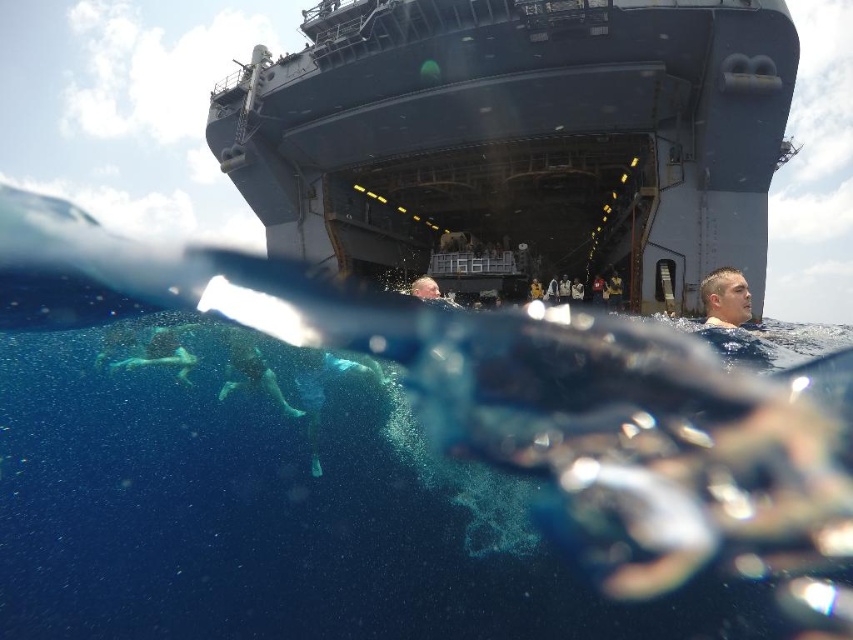
Question: Which of the following is the closest to the observer?

Choices:
 (A) blue fabric swimmer at lower left
 (B) green fabric swimmer at lower center
 (C) transparent blue water at center

Answer: (C)

Question: Can you confirm if green fabric swimmer at lower center is positioned to the left of blue fabric swimmer at lower left?

Choices:
 (A) yes
 (B) no

Answer: (B)

Question: Does transparent blue water at center appear on the right side of dark gray metallic ship at upper center?

Choices:
 (A) yes
 (B) no

Answer: (B)

Question: Which object is the farthest from the blue fabric swimmer at lower left?

Choices:
 (A) transparent blue water at center
 (B) green fabric swimmer at lower center

Answer: (A)

Question: Which point is farther to the camera?

Choices:
 (A) green fabric swimmer at lower center
 (B) dark gray metallic ship at upper center
 (C) blue fabric swimmer at lower left

Answer: (B)

Question: Does dark gray metallic ship at upper center have a lesser width compared to blue fabric swimmer at lower left?

Choices:
 (A) yes
 (B) no

Answer: (B)